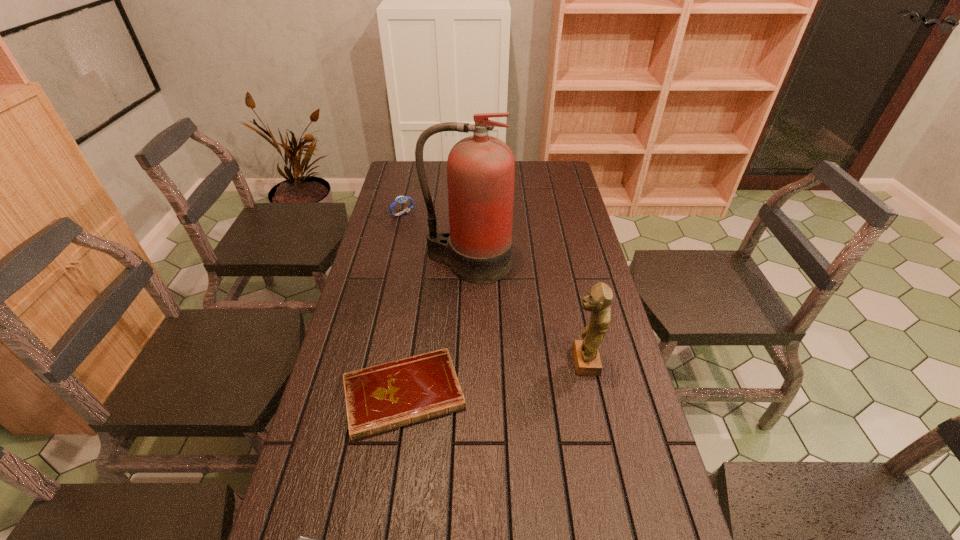
Locate an element on the screen. The height and width of the screenshot is (540, 960). vacant space in between the notebook and the tallest object is located at coordinates (436, 329).

This screenshot has width=960, height=540. I want to click on empty space that is in between the third tallest object and the fourth tallest object, so click(403, 304).

The image size is (960, 540). I want to click on free space between the notebook and the tallest object, so coord(436,329).

The image size is (960, 540). What are the coordinates of `object that is the closest to the watch` in the screenshot? It's located at (480, 169).

Identify which object is the second closest to the figurine. Please provide its 2D coordinates. Your answer should be formatted as a tuple, i.e. [(x, y)], where the tuple contains the x and y coordinates of a point satisfying the conditions above.

[(480, 169)]

Locate an element on the screen. vacant region that satisfies the following two spatial constraints: 1. on the front-facing side of the figurine; 2. on the front side of the second shortest object is located at coordinates (590, 395).